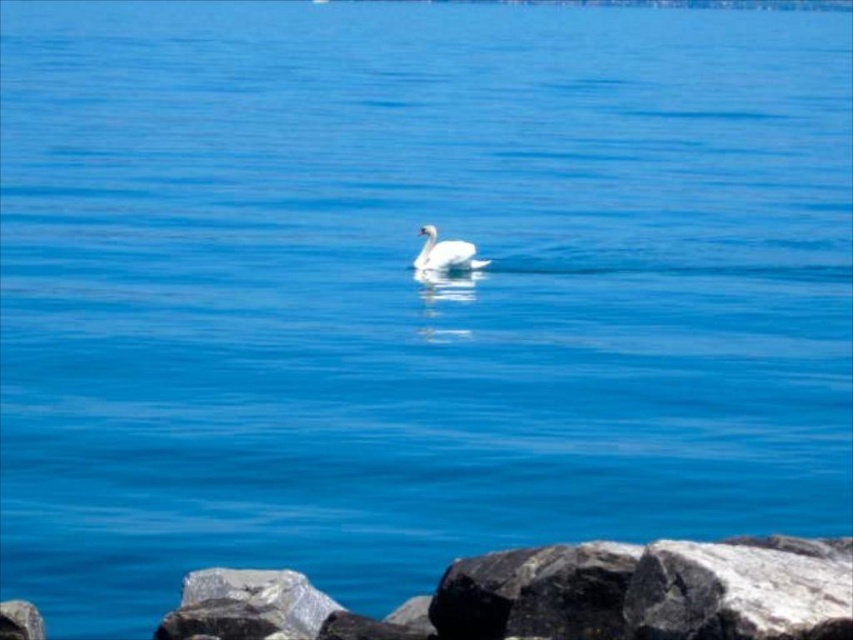
Question: Does gray rock at lower center have a greater width compared to white glossy swan at center?

Choices:
 (A) yes
 (B) no

Answer: (A)

Question: Does gray rock at lower center appear on the right side of white glossy swan at center?

Choices:
 (A) no
 (B) yes

Answer: (A)

Question: Does gray rock at lower center come behind white glossy swan at center?

Choices:
 (A) yes
 (B) no

Answer: (B)